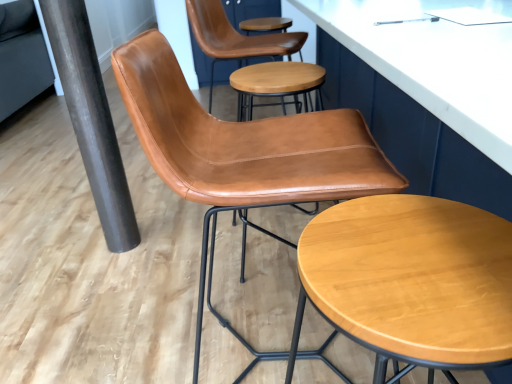
Identify the location of vacant area in front of black metallic pole at lower left. Image resolution: width=512 pixels, height=384 pixels. (112, 266).